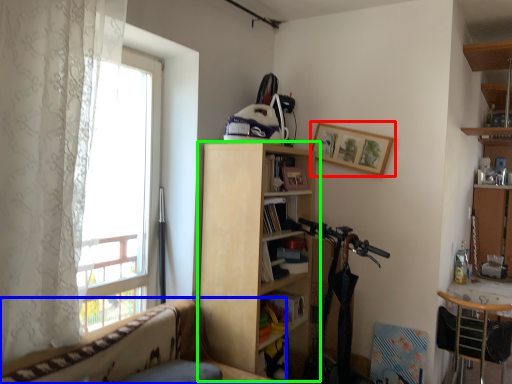
Question: Estimate the real-world distances between objects in this image. Which object is closer to picture frame (highlighted by a red box), studio couch (highlighted by a blue box) or bookcase (highlighted by a green box)?

Choices:
 (A) studio couch
 (B) bookcase

Answer: (B)